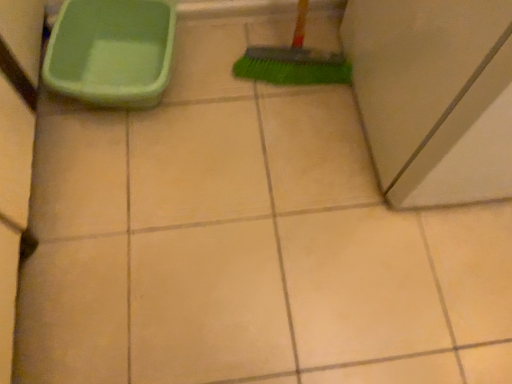
Question: Is green plastic bucket at upper left closer to camera compared to matte gray cabinet at right?

Choices:
 (A) yes
 (B) no

Answer: (B)

Question: From the image's perspective, is green plastic bucket at upper left under matte gray cabinet at right?

Choices:
 (A) no
 (B) yes

Answer: (B)

Question: Is green plastic bucket at upper left looking in the opposite direction of matte gray cabinet at right?

Choices:
 (A) yes
 (B) no

Answer: (B)

Question: From a real-world perspective, is green plastic bucket at upper left located beneath matte gray cabinet at right?

Choices:
 (A) no
 (B) yes

Answer: (B)

Question: Does green plastic bucket at upper left appear on the left side of matte gray cabinet at right?

Choices:
 (A) yes
 (B) no

Answer: (A)

Question: From the image's perspective, would you say green plastic bucket at upper left is positioned over matte gray cabinet at right?

Choices:
 (A) no
 (B) yes

Answer: (A)

Question: From the image's perspective, would you say matte gray cabinet at right is shown under green plastic bucket at upper left?

Choices:
 (A) yes
 (B) no

Answer: (B)

Question: Is matte gray cabinet at right to the left of green plastic bucket at upper left from the viewer's perspective?

Choices:
 (A) yes
 (B) no

Answer: (B)

Question: Can you confirm if matte gray cabinet at right is bigger than green plastic bucket at upper left?

Choices:
 (A) yes
 (B) no

Answer: (A)

Question: Is matte gray cabinet at right wider than green plastic bucket at upper left?

Choices:
 (A) no
 (B) yes

Answer: (B)

Question: Considering the relative sizes of matte gray cabinet at right and green plastic bucket at upper left in the image provided, is matte gray cabinet at right thinner than green plastic bucket at upper left?

Choices:
 (A) no
 (B) yes

Answer: (A)

Question: Does matte gray cabinet at right appear on the right side of green plastic bucket at upper left?

Choices:
 (A) no
 (B) yes

Answer: (B)

Question: Does point (x=509, y=61) appear closer or farther from the camera than point (x=90, y=29)?

Choices:
 (A) closer
 (B) farther

Answer: (A)